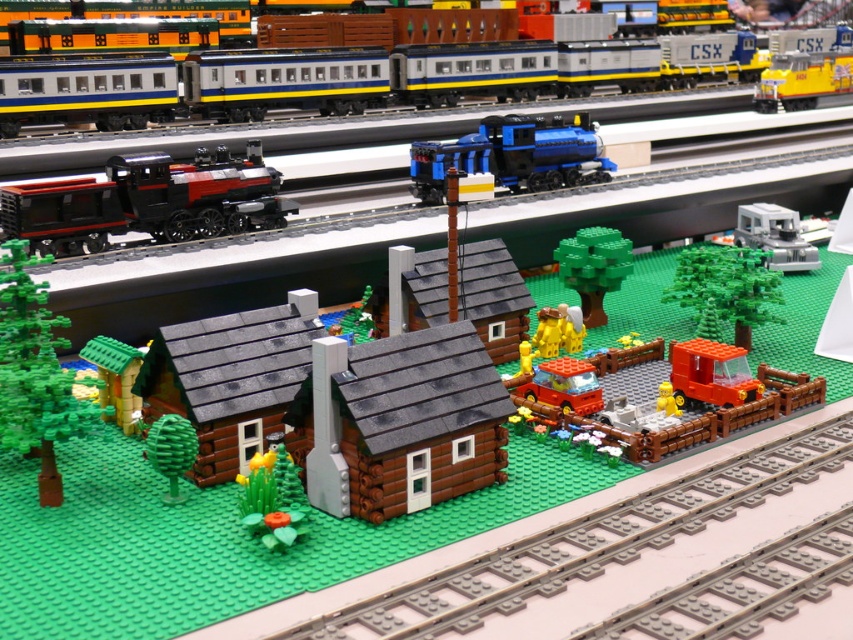
Question: Is the position of brushed metal train at upper center more distant than that of blue metallic train at center?

Choices:
 (A) yes
 (B) no

Answer: (A)

Question: Which point is closer to the camera?

Choices:
 (A) (254, 212)
 (B) (351, 621)
 (C) (584, 141)

Answer: (B)

Question: Estimate the real-world distances between objects in this image. Which object is closer to the blue metallic train at center?

Choices:
 (A) black matte train at left
 (B) brown wooden train track at lower center
 (C) brushed metal train at upper center

Answer: (A)

Question: Which point is farther from the camera taking this photo?

Choices:
 (A) (503, 550)
 (B) (233, 90)
 (C) (86, 204)

Answer: (B)

Question: Does brushed metal train at upper center have a larger size compared to blue metallic train at center?

Choices:
 (A) yes
 (B) no

Answer: (A)

Question: Is brown wooden train track at lower center smaller than brushed metal train at upper center?

Choices:
 (A) no
 (B) yes

Answer: (B)